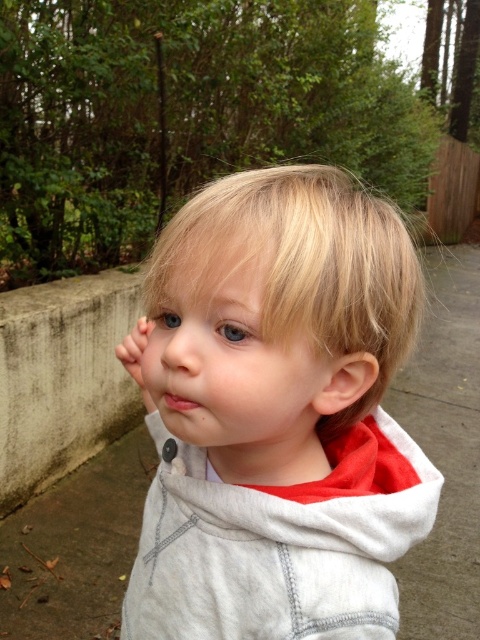
You are a photographer trying to capture the white cotton hoodie at center in your shot. The camera is positioned at the origin point. Can you determine if the hoodie is within the camera frame based on its coordinates?

The white cotton hoodie at center is located at point (279, 416), which is within the standard camera frame that typically spans from 0 to 1 on both axes. Therefore, the hoodie is within the camera frame.

Looking at the child in the image, which facial feature is bigger between the smooth skin nose at center and the pink matte lips at center?

The smooth skin nose at center is larger than the pink matte lips at center.

Based on the scene description, if you were to draw a vertical line through the center of the child, where would the smooth skin nose at center and the pink matte lips at center be positioned relative to each other?

The smooth skin nose at center is positioned above the pink matte lips at center.